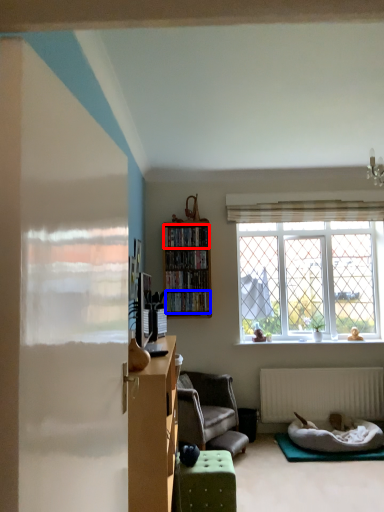
Question: Among these objects, which one is nearest to the camera, cabinet (highlighted by a red box) or shelf (highlighted by a blue box)?

Choices:
 (A) cabinet
 (B) shelf

Answer: (B)